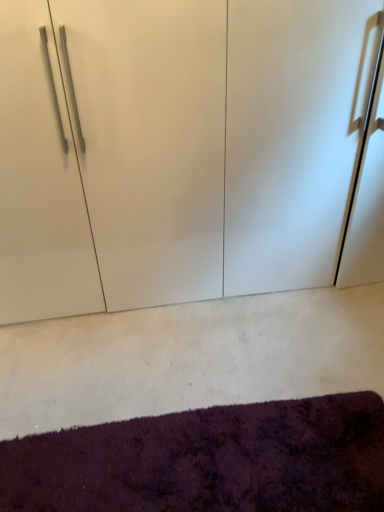
Image resolution: width=384 pixels, height=512 pixels. Describe the element at coordinates (208, 460) in the screenshot. I see `shaggy purple mat at lower center` at that location.

Where is `shaggy purple mat at lower center`? shaggy purple mat at lower center is located at coordinates (208, 460).

What do you see at coordinates (185, 151) in the screenshot? I see `white glossy cupboard at center` at bounding box center [185, 151].

Identify the location of white glossy cupboard at center. (185, 151).

In order to click on shaggy purple mat at lower center in this screenshot , I will do `click(208, 460)`.

Does shaggy purple mat at lower center appear on the right side of white glossy cupboard at center?

In fact, shaggy purple mat at lower center is to the left of white glossy cupboard at center.

Considering the positions of objects shaggy purple mat at lower center and white glossy cupboard at center in the image provided, who is in front, shaggy purple mat at lower center or white glossy cupboard at center?

shaggy purple mat at lower center is more forward.

Is point (26, 475) more distant than point (353, 97)?

No, it is in front of (353, 97).

From the image's perspective, between shaggy purple mat at lower center and white glossy cupboard at center, who is located below?

shaggy purple mat at lower center, from the image's perspective.

Consider the image. From a real-world perspective, which is physically below, shaggy purple mat at lower center or white glossy cupboard at center?

shaggy purple mat at lower center is physically lower.

Does shaggy purple mat at lower center have a lesser width compared to white glossy cupboard at center?

Correct, the width of shaggy purple mat at lower center is less than that of white glossy cupboard at center.

Does shaggy purple mat at lower center have a lesser height compared to white glossy cupboard at center?

Yes.

Considering the sizes of shaggy purple mat at lower center and white glossy cupboard at center in the image, is shaggy purple mat at lower center bigger or smaller than white glossy cupboard at center?

Considering their sizes, shaggy purple mat at lower center takes up less space than white glossy cupboard at center.

Do you think shaggy purple mat at lower center is within white glossy cupboard at center, or outside of it?

shaggy purple mat at lower center is outside white glossy cupboard at center.

Would you say shaggy purple mat at lower center is a long distance from white glossy cupboard at center?

No, shaggy purple mat at lower center is in close proximity to white glossy cupboard at center.

Is shaggy purple mat at lower center facing away from white glossy cupboard at center?

No.

Can you tell me how much shaggy purple mat at lower center and white glossy cupboard at center differ in facing direction?

The facing directions of shaggy purple mat at lower center and white glossy cupboard at center are 0.15 degrees apart.

You are a GUI agent. You are given a task and a screenshot of the screen. Output one action in this format:
    pyautogui.click(x=<x>, y=<y>)
    Task: Click on the mat on the left of white glossy cupboard at center
    
    Given the screenshot: What is the action you would take?
    pyautogui.click(x=208, y=460)

In the image, is white glossy cupboard at center on the left side or the right side of shaggy purple mat at lower center?

In the image, white glossy cupboard at center appears on the right side of shaggy purple mat at lower center.

Is white glossy cupboard at center in front of shaggy purple mat at lower center?

No, it is not.

Is point (302, 162) closer to viewer compared to point (313, 493)?

That is False.

From the image's perspective, relative to shaggy purple mat at lower center, is white glossy cupboard at center above or below?

white glossy cupboard at center is situated higher than shaggy purple mat at lower center in the image.

From a real-world perspective, is white glossy cupboard at center physically located above or below shaggy purple mat at lower center?

Clearly, from a real-world perspective, white glossy cupboard at center is above shaggy purple mat at lower center.

Which object is thinner, white glossy cupboard at center or shaggy purple mat at lower center?

shaggy purple mat at lower center is thinner.

Between white glossy cupboard at center and shaggy purple mat at lower center, which one has more height?

white glossy cupboard at center is taller.

From the picture: Does white glossy cupboard at center have a smaller size compared to shaggy purple mat at lower center?

No.

Can we say white glossy cupboard at center lies outside shaggy purple mat at lower center?

Yes, white glossy cupboard at center is located beyond the bounds of shaggy purple mat at lower center.

Is white glossy cupboard at center positioned far away from shaggy purple mat at lower center?

Actually, white glossy cupboard at center and shaggy purple mat at lower center are a little close together.

Is white glossy cupboard at center looking in the opposite direction of shaggy purple mat at lower center?

white glossy cupboard at center is not turned away from shaggy purple mat at lower center.

Based on the photo, what's the angular difference between white glossy cupboard at center and shaggy purple mat at lower center's facing directions?

They differ by 0.15 degrees in their facing directions.

Locate an element on the screen. mat that appears in front of the white glossy cupboard at center is located at coordinates (208, 460).

Image resolution: width=384 pixels, height=512 pixels. What are the coordinates of `mat located in front of the white glossy cupboard at center` in the screenshot? It's located at (208, 460).

Where is `cupboard above the shaggy purple mat at lower center (from a real-world perspective)`? The width and height of the screenshot is (384, 512). cupboard above the shaggy purple mat at lower center (from a real-world perspective) is located at coordinates (185, 151).